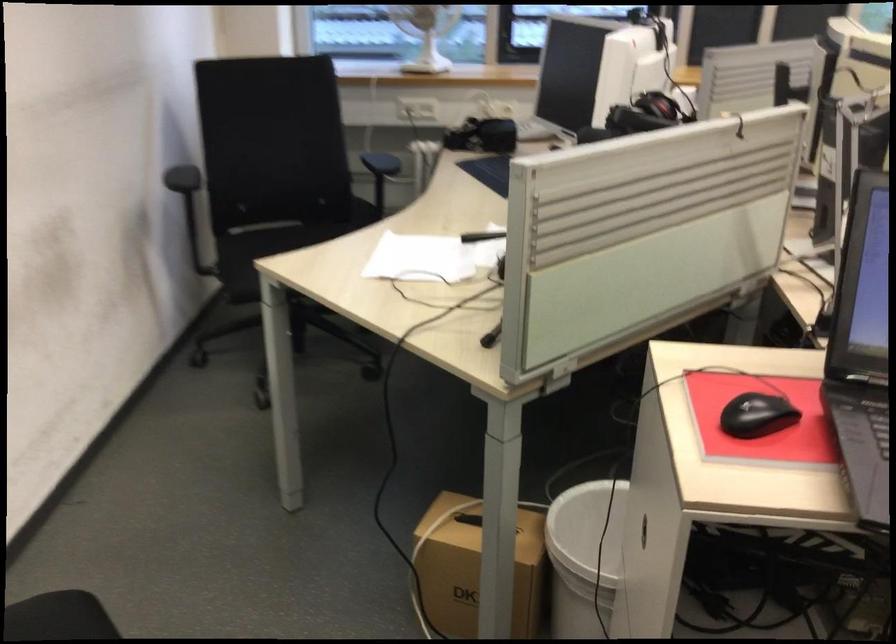
Identify the location of chair sitting surface. Image resolution: width=896 pixels, height=644 pixels. (x=263, y=252).